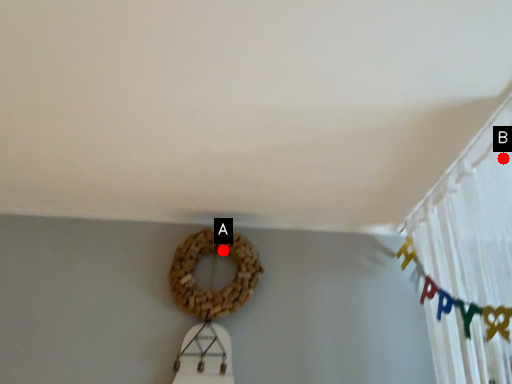
Question: Two points are circled on the image, labeled by A and B beside each circle. Which point is farther to the camera?

Choices:
 (A) A is further
 (B) B is further

Answer: (A)